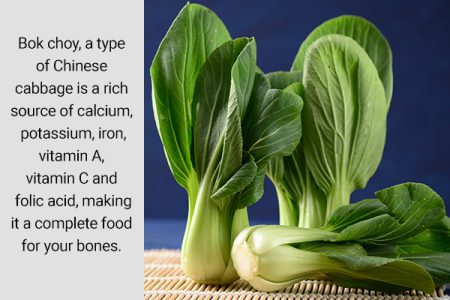
The width and height of the screenshot is (450, 300). I want to click on plant base, so click(245, 260), click(214, 282).